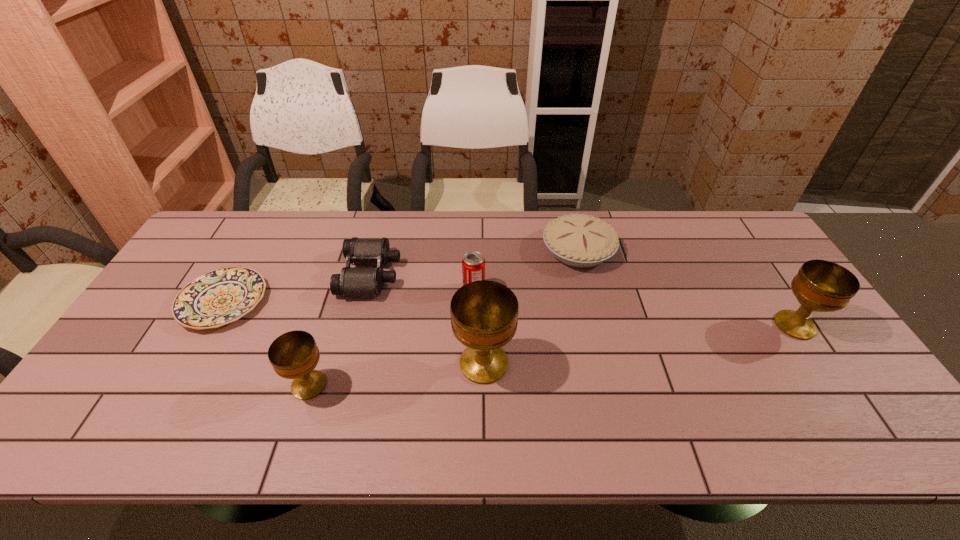
Locate an element on the screen. free space that satisfies the following two spatial constraints: 1. through the eyepieces of the binoculars; 2. on the back side of the second tallest object is located at coordinates (357, 325).

Locate an element on the screen. This screenshot has height=540, width=960. blank space that satisfies the following two spatial constraints: 1. through the eyepieces of the binoculars; 2. on the front side of the plate is located at coordinates pyautogui.click(x=363, y=301).

Image resolution: width=960 pixels, height=540 pixels. I want to click on blank area in the image that satisfies the following two spatial constraints: 1. through the eyepieces of the binoculars; 2. on the back side of the tallest chalice, so click(348, 363).